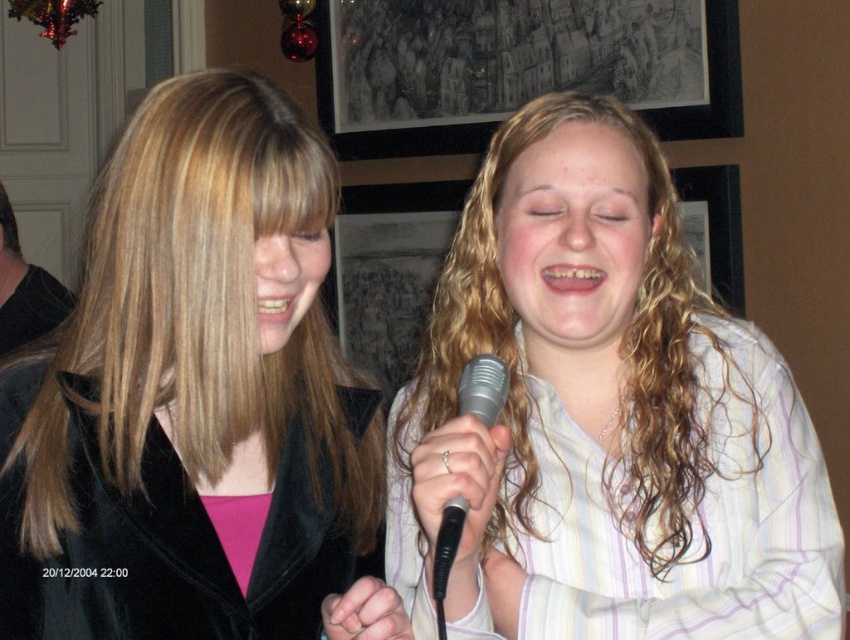
You are a photographer trying to capture a candid shot of the silver metallic microphone at center and the matte black jacket at left. Since you want the microphone to be the main focus, should you adjust your camera to focus on the object that is closer to the lens?

The matte black jacket at left is above the silver metallic microphone at center, so the microphone is closer to the lens. Therefore, focusing on the silver metallic microphone at center will make it the main focus.

You are a photographer trying to capture a candid shot of both the white striped shirt at center and the matte black jacket at left. Based on their positions, which one is lower in the frame?

The white striped shirt at center is positioned under the matte black jacket at left, so it is lower in the frame.

You are a photographer standing in front of the matte black jacket at left. You want to take a closeup photo of the jacket without moving it. What is the minimum distance you need to be from the jacket to focus properly?

The matte black jacket at left is 30.03 inches away from camera. To take a closeup photo without moving the jacket, you need to be at least 30.03 inches away from it to ensure proper focus.